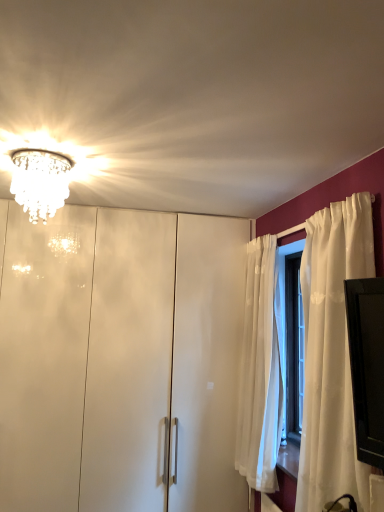
Question: Considering their positions, is crystal glass chandelier at upper left located in front of or behind glossy white dresser at center?

Choices:
 (A) front
 (B) behind

Answer: (A)

Question: In terms of size, does crystal glass chandelier at upper left appear bigger or smaller than glossy white dresser at center?

Choices:
 (A) big
 (B) small

Answer: (B)

Question: From the image's perspective, is crystal glass chandelier at upper left positioned above or below glossy white dresser at center?

Choices:
 (A) below
 (B) above

Answer: (B)

Question: Considering their positions, is glossy white dresser at center located in front of or behind crystal glass chandelier at upper left?

Choices:
 (A) behind
 (B) front

Answer: (A)

Question: Does point (127, 324) appear closer or farther from the camera than point (54, 181)?

Choices:
 (A) closer
 (B) farther

Answer: (B)

Question: Is glossy white dresser at center wider or thinner than crystal glass chandelier at upper left?

Choices:
 (A) thin
 (B) wide

Answer: (B)

Question: Considering the positions of glossy white dresser at center and crystal glass chandelier at upper left in the image, is glossy white dresser at center bigger or smaller than crystal glass chandelier at upper left?

Choices:
 (A) big
 (B) small

Answer: (A)